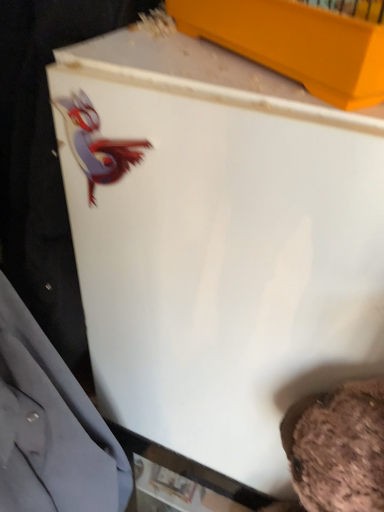
Question: Based on their positions, is matte yellow box at upper center located to the left or right of matte gray dress shirt at left?

Choices:
 (A) right
 (B) left

Answer: (A)

Question: From the image's perspective, is matte yellow box at upper center above or below matte gray dress shirt at left?

Choices:
 (A) above
 (B) below

Answer: (A)

Question: From their relative heights in the image, would you say matte yellow box at upper center is taller or shorter than matte gray dress shirt at left?

Choices:
 (A) short
 (B) tall

Answer: (A)

Question: Considering the positions of matte gray dress shirt at left and matte yellow box at upper center in the image, is matte gray dress shirt at left bigger or smaller than matte yellow box at upper center?

Choices:
 (A) small
 (B) big

Answer: (B)

Question: In the image, is matte gray dress shirt at left positioned in front of or behind matte yellow box at upper center?

Choices:
 (A) behind
 (B) front

Answer: (B)

Question: From a real-world perspective, is matte gray dress shirt at left above or below matte yellow box at upper center?

Choices:
 (A) above
 (B) below

Answer: (B)

Question: Which is correct: matte gray dress shirt at left is inside matte yellow box at upper center, or outside of it?

Choices:
 (A) outside
 (B) inside

Answer: (A)